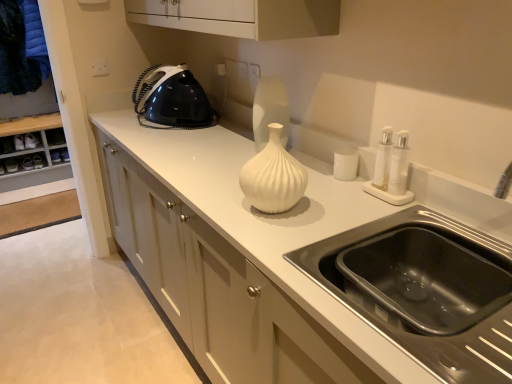
Question: From a real-world perspective, is white glossy cabinet at center located higher than dark blue fabric at left?

Choices:
 (A) no
 (B) yes

Answer: (A)

Question: Can we say white glossy cabinet at center lies outside dark blue fabric at left?

Choices:
 (A) yes
 (B) no

Answer: (A)

Question: Is white glossy cabinet at center behind dark blue fabric at left?

Choices:
 (A) yes
 (B) no

Answer: (B)

Question: From the image's perspective, would you say white glossy cabinet at center is shown under dark blue fabric at left?

Choices:
 (A) no
 (B) yes

Answer: (B)

Question: Can you confirm if white glossy cabinet at center is thinner than dark blue fabric at left?

Choices:
 (A) yes
 (B) no

Answer: (B)

Question: Relative to wooden dresser at left, is dark blue fabric at left in front or behind?

Choices:
 (A) behind
 (B) front

Answer: (A)

Question: Considering the positions of dark blue fabric at left and wooden dresser at left in the image, is dark blue fabric at left bigger or smaller than wooden dresser at left?

Choices:
 (A) big
 (B) small

Answer: (B)

Question: Looking at their shapes, would you say dark blue fabric at left is wider or thinner than wooden dresser at left?

Choices:
 (A) wide
 (B) thin

Answer: (B)

Question: Is point (36, 61) positioned closer to the camera than point (15, 185)?

Choices:
 (A) farther
 (B) closer

Answer: (A)

Question: Is black plastic iron at upper left situated inside white matte vase at center or outside?

Choices:
 (A) inside
 (B) outside

Answer: (B)

Question: Looking at their shapes, would you say black plastic iron at upper left is wider or thinner than white matte vase at center?

Choices:
 (A) wide
 (B) thin

Answer: (A)

Question: From a real-world perspective, is black plastic iron at upper left physically located above or below white matte vase at center?

Choices:
 (A) below
 (B) above

Answer: (B)

Question: Considering the positions of black plastic iron at upper left and white matte vase at center in the image, is black plastic iron at upper left bigger or smaller than white matte vase at center?

Choices:
 (A) small
 (B) big

Answer: (B)

Question: Is white matte cup at center taller or shorter than black stainless steel sink at lower right?

Choices:
 (A) tall
 (B) short

Answer: (B)

Question: From a real-world perspective, is white matte cup at center positioned above or below black stainless steel sink at lower right?

Choices:
 (A) below
 (B) above

Answer: (B)